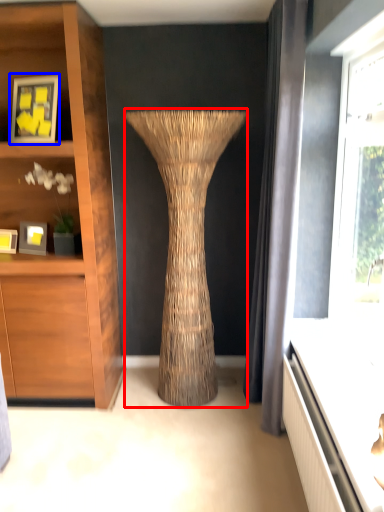
Question: Which object is further to the camera taking this photo, vase (highlighted by a red box) or picture frame (highlighted by a blue box)?

Choices:
 (A) vase
 (B) picture frame

Answer: (B)